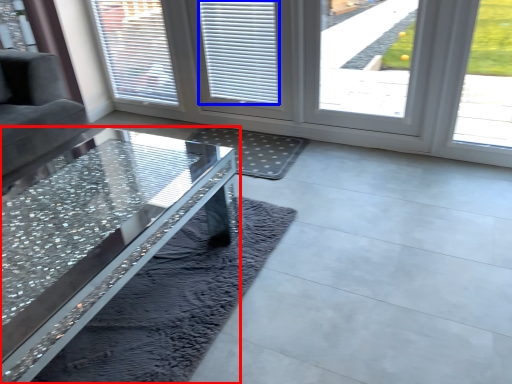
Question: Which point is closer to the camera, table (highlighted by a red box) or blind (highlighted by a blue box)?

Choices:
 (A) table
 (B) blind

Answer: (A)